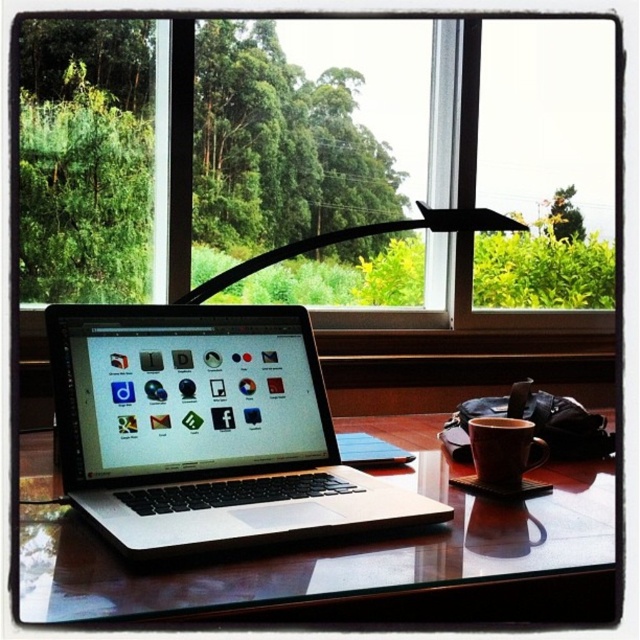
You are organizing items on your desk and need to place a new object between the transparent glass window at center and the matte ceramic mug at center. Which item should you place closer to the window to ensure there is enough space?

Since the transparent glass window at center is wider than the matte ceramic mug at center, you should place the new object closer to the matte ceramic mug at center to accommodate the wider window.